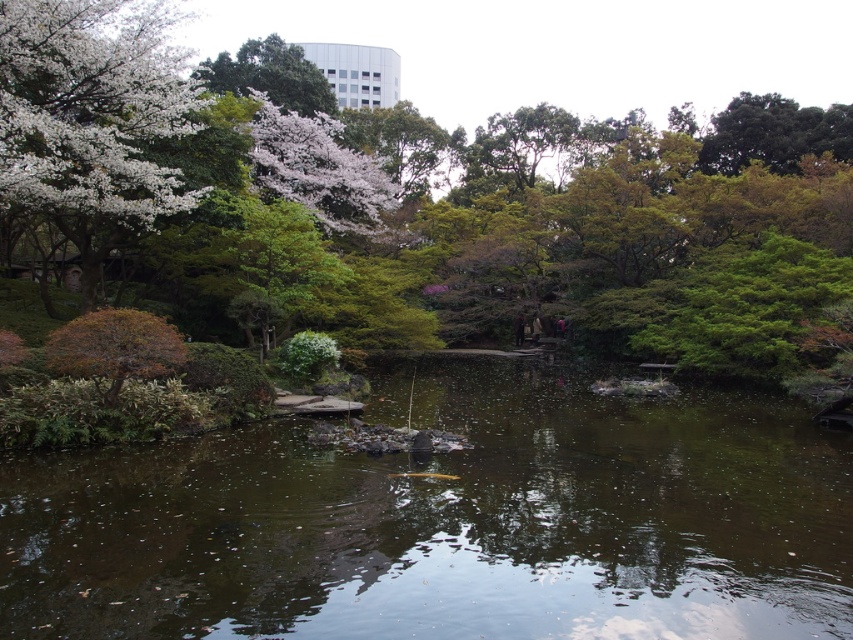
You are standing in the garden and want to walk from the point closer to you to the point further away. Which path should you take between point (x=19, y=138) and point (x=0, y=26)?

You should walk from point (x=0, y=26) to point (x=19, y=138) because point (x=19, y=138) is further to the viewer than point (x=0, y=26).